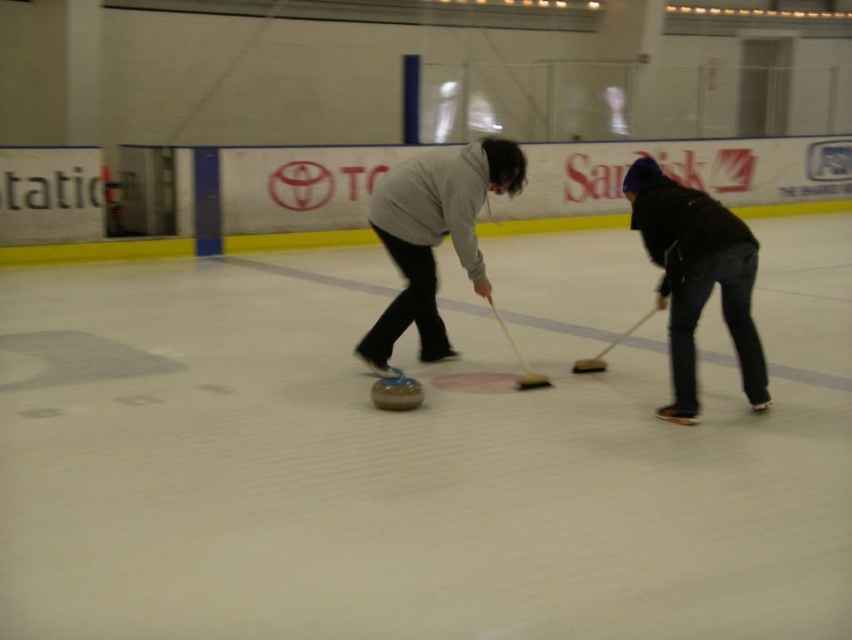
Question: Observing the image, what is the correct spatial positioning of brown wooden hockey at center in reference to smooth brown hockey at center?

Choices:
 (A) below
 (B) above

Answer: (A)

Question: Considering the relative positions of brown wooden hockey at center and smooth brown hockey at center in the image provided, where is brown wooden hockey at center located with respect to smooth brown hockey at center?

Choices:
 (A) above
 (B) below

Answer: (B)

Question: Which of the following is the closest to the observer?

Choices:
 (A) (377, 356)
 (B) (628, 333)
 (C) (746, 388)
 (D) (515, 342)

Answer: (C)

Question: Is the position of matte gray sweater at center more distant than that of black matte jacket at lower right?

Choices:
 (A) no
 (B) yes

Answer: (B)

Question: Among these objects, which one is nearest to the camera?

Choices:
 (A) matte gray sweater at center
 (B) smooth brown hockey at center
 (C) brown wooden hockey at center
 (D) black matte jacket at lower right

Answer: (D)

Question: Which object appears farthest from the camera in this image?

Choices:
 (A) brown wooden hockey at center
 (B) matte gray sweater at center
 (C) smooth brown hockey at center

Answer: (C)